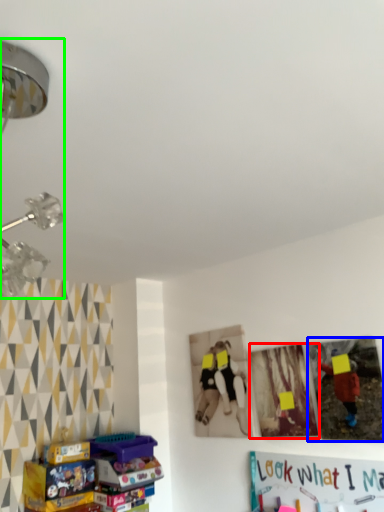
Question: Considering the real-world distances, which object is farthest from picture frame (highlighted by a red box)? picture frame (highlighted by a blue box) or lamp (highlighted by a green box)?

Choices:
 (A) picture frame
 (B) lamp

Answer: (B)